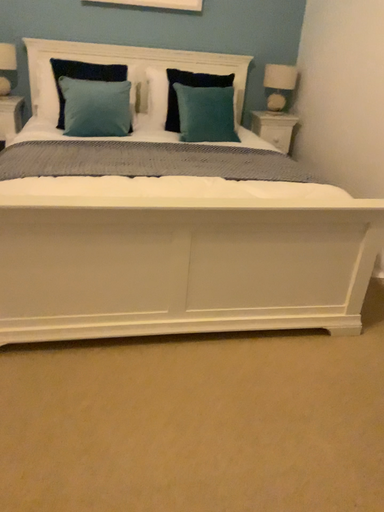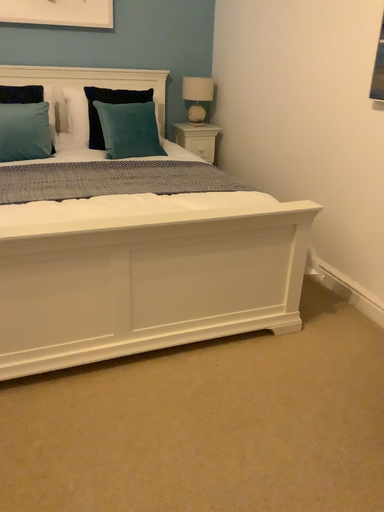
Question: How did the camera likely rotate when shooting the video?

Choices:
 (A) rotated right
 (B) rotated left

Answer: (A)